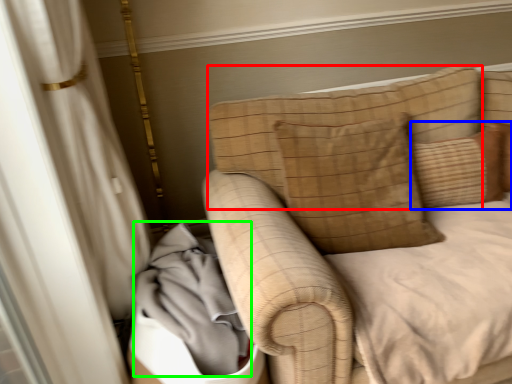
Question: Considering the real-world distances, which object is closest to pillow (highlighted by a red box)? pillow (highlighted by a blue box) or material (highlighted by a green box).

Choices:
 (A) pillow
 (B) material

Answer: (A)